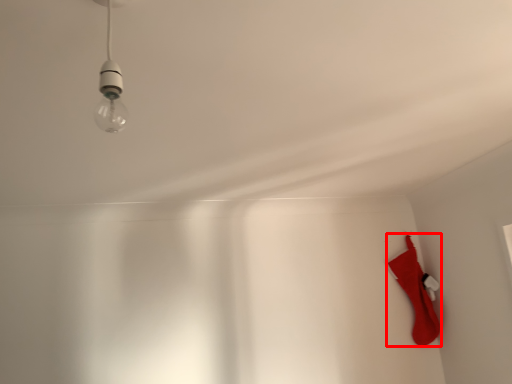
Question: From the image's perspective, where is sock (annotated by the red box) located in relation to lamp in the image?

Choices:
 (A) below
 (B) above

Answer: (A)